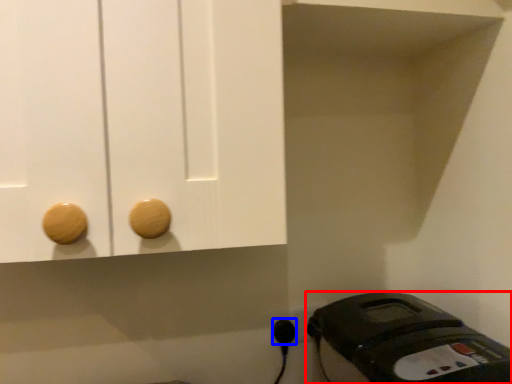
Question: Which point is closer to the camera, home appliance (highlighted by a red box) or plug (highlighted by a blue box)?

Choices:
 (A) home appliance
 (B) plug

Answer: (A)